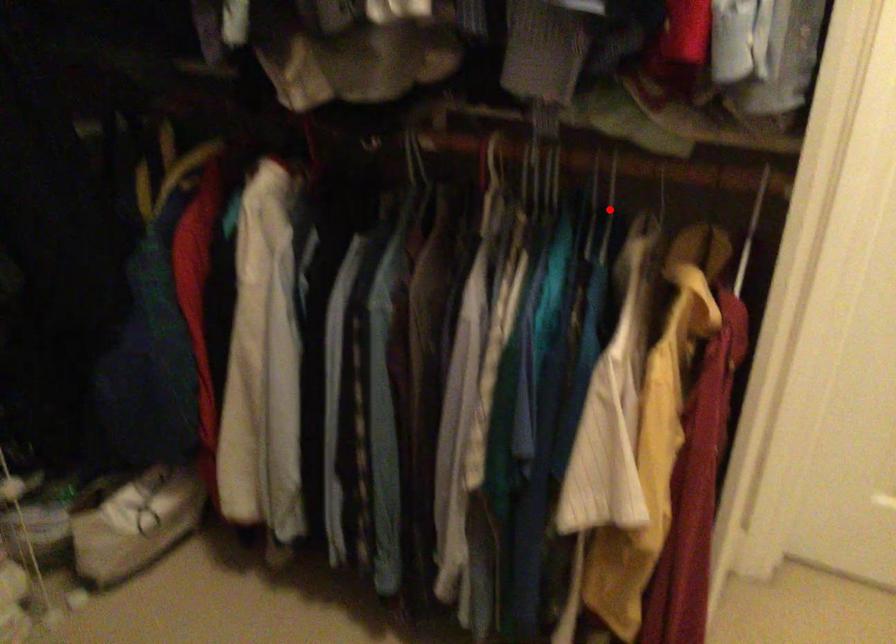
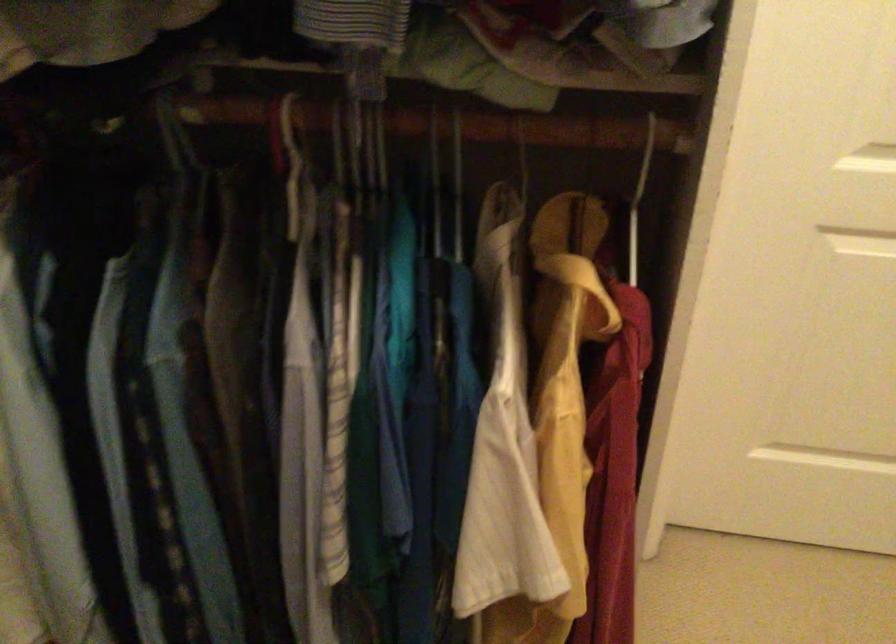
Question: I am providing you with two images of the same scene from different viewpoints. In image1, a red point is highlighted. Considering the same 3D point in image2, which of the following is correct?

Choices:
 (A) It is closer
 (B) It is farther

Answer: (A)